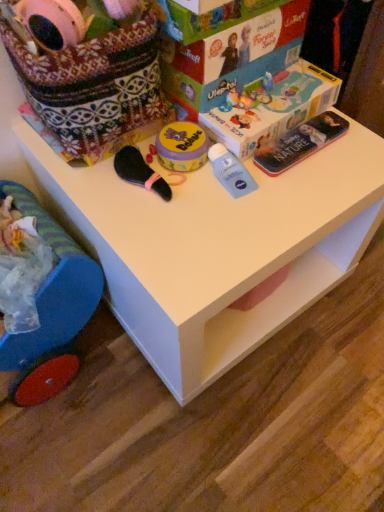
Question: Relative to matte cardboard box at upper center, is white plastic table at center in front or behind?

Choices:
 (A) behind
 (B) front

Answer: (B)

Question: Looking at their shapes, would you say white plastic table at center is wider or thinner than matte cardboard box at upper center?

Choices:
 (A) wide
 (B) thin

Answer: (A)

Question: Considering the real-world distances, which object is closest to the blue plastic toy at lower left?

Choices:
 (A) matte cardboard box at upper center
 (B) white plastic table at center
 (C) matte plastic magazine at upper right

Answer: (B)

Question: Based on their relative distances, which object is nearer to the white plastic table at center?

Choices:
 (A) matte cardboard box at upper center
 (B) blue plastic toy at lower left
 (C) matte plastic magazine at upper right

Answer: (B)